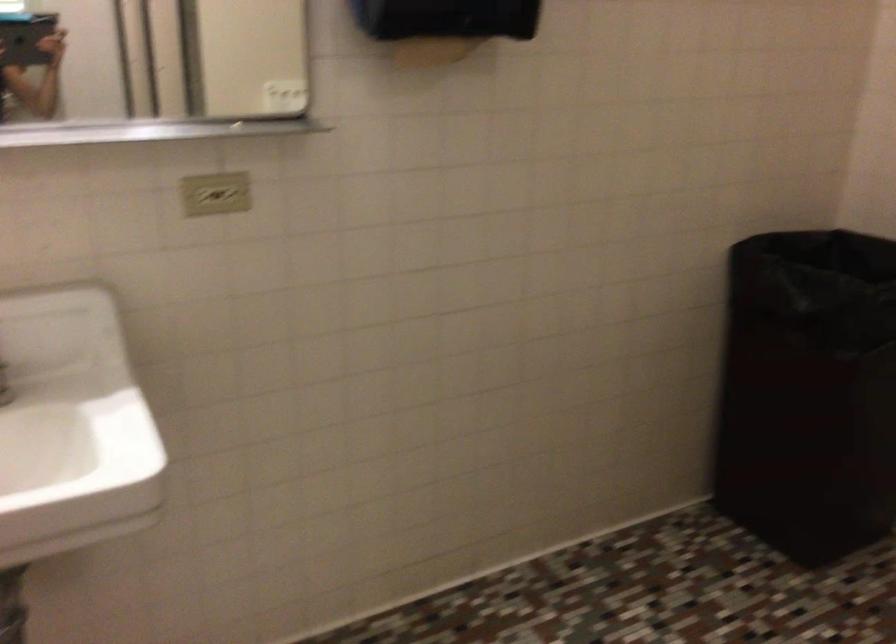
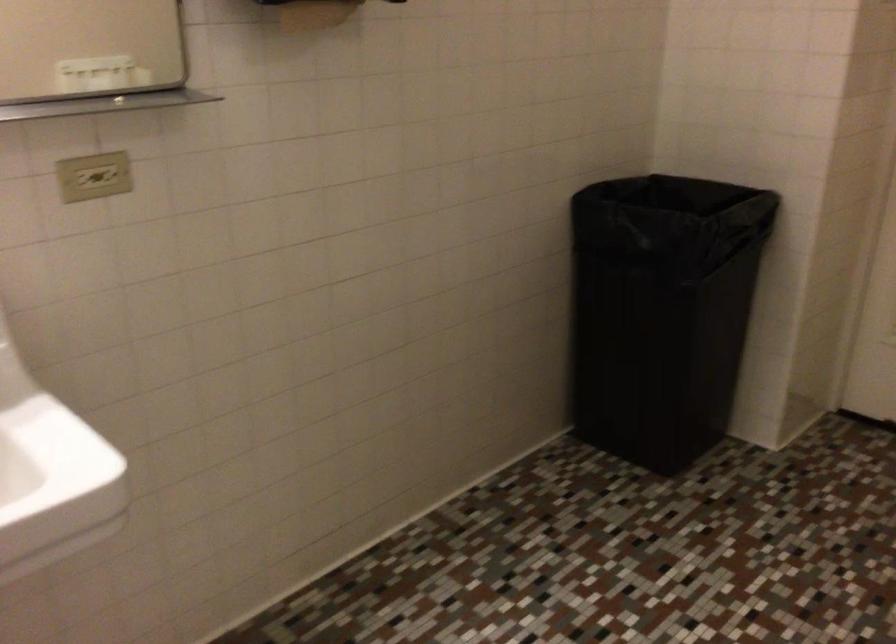
Question: In a continuous first-person perspective shot, in which direction is the camera moving?

Choices:
 (A) Left
 (B) Right
 (C) Forward
 (D) Backward

Answer: (A)